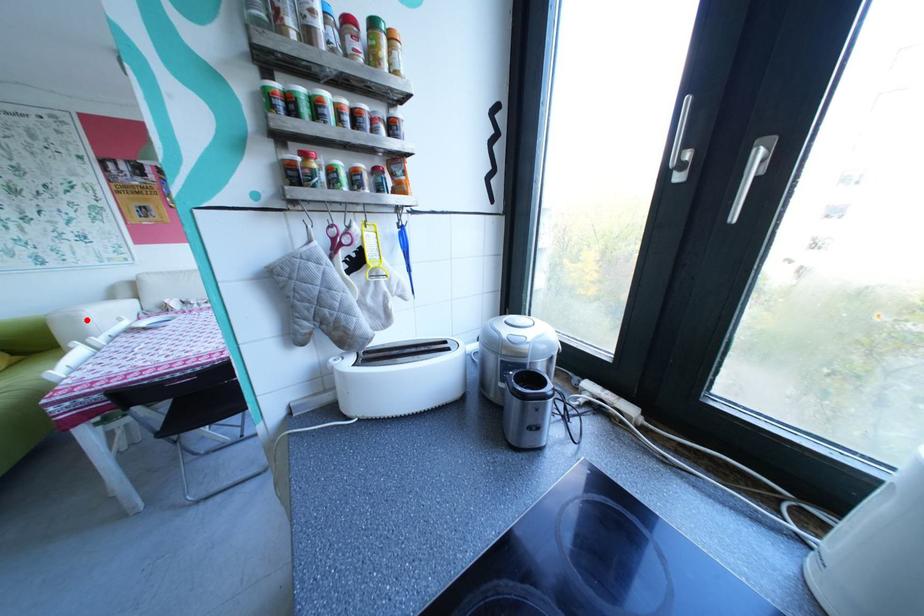
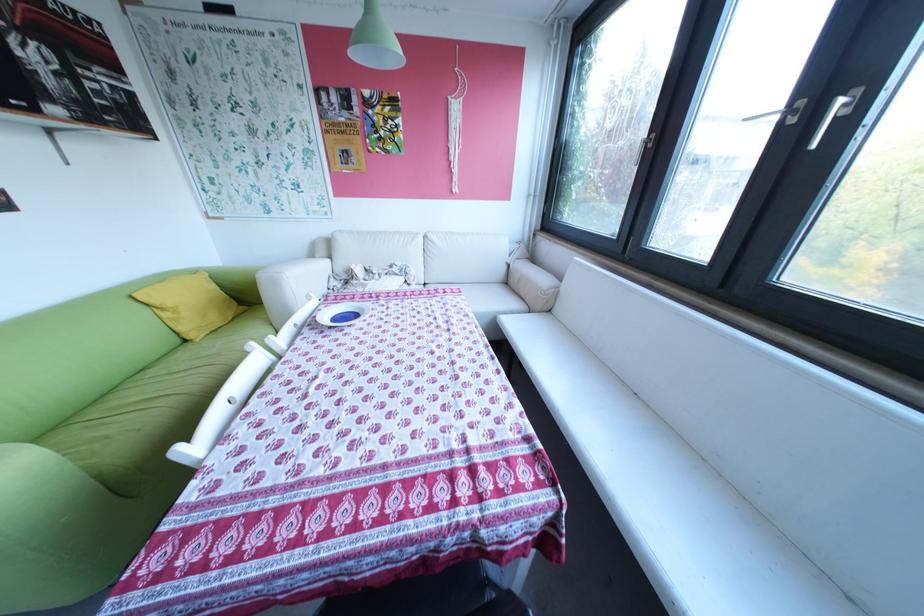
Question: I am providing you with two images of the same scene from different viewpoints. Given a red point in image1, look at the same physical point in image2. Is it:

Choices:
 (A) Closer to the viewpoint
 (B) Farther from the viewpoint

Answer: (A)